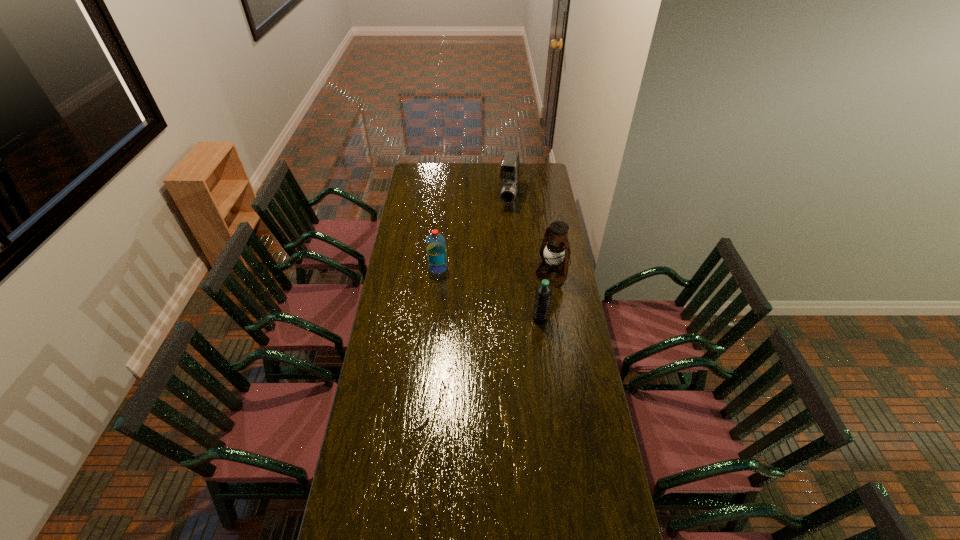
I want to click on free space between the leftmost object and the nearer water bottle, so click(489, 293).

Locate an element on the screen. This screenshot has width=960, height=540. vacant space in between the right water bottle and the farther water bottle is located at coordinates (489, 293).

At what (x,y) coordinates should I click in order to perform the action: click on free space between the nearer water bottle and the leftmost object. Please return your answer as a coordinate pair (x, y). This screenshot has width=960, height=540. Looking at the image, I should click on (489, 293).

Where is `free space between the nearest object and the farther water bottle`? The image size is (960, 540). free space between the nearest object and the farther water bottle is located at coordinates (489, 293).

Locate an element on the screen. This screenshot has height=540, width=960. free space between the third object from right to left and the nearer water bottle is located at coordinates (524, 258).

Identify which object is the closest to the right water bottle. Please provide its 2D coordinates. Your answer should be formatted as a tuple, i.e. [(x, y)], where the tuple contains the x and y coordinates of a point satisfying the conditions above.

[(557, 252)]

The height and width of the screenshot is (540, 960). In order to click on the second closest object to the tallest object in this screenshot , I will do pos(509,173).

This screenshot has height=540, width=960. I want to click on blank area in the image that satisfies the following two spatial constraints: 1. on the front side of the nearest object; 2. on the left side of the farthest object, so click(518, 319).